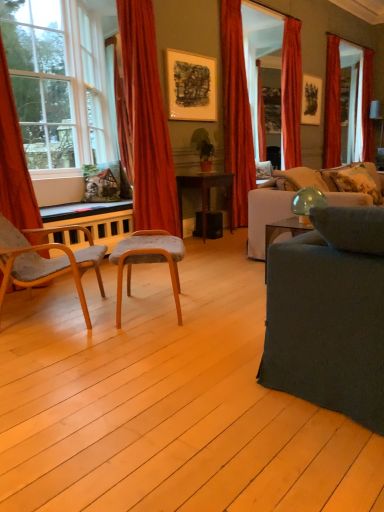
Identify the location of vacant space underneath wooden chair at left, marked as the 1th chair in a left-to-right arrangement (from a real-world perspective). This screenshot has height=512, width=384. (45, 312).